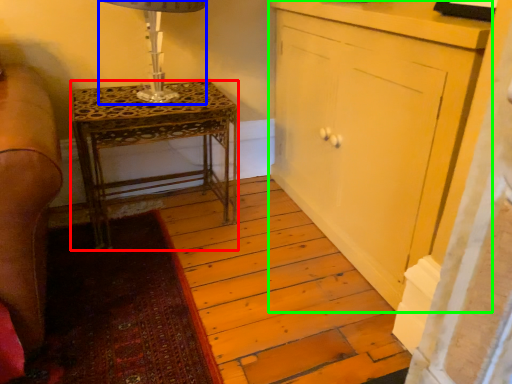
Question: Which object is the farthest from nightstand (highlighted by a red box)? Choose among these: table lamp (highlighted by a blue box) or cabinetry (highlighted by a green box).

Choices:
 (A) table lamp
 (B) cabinetry

Answer: (B)